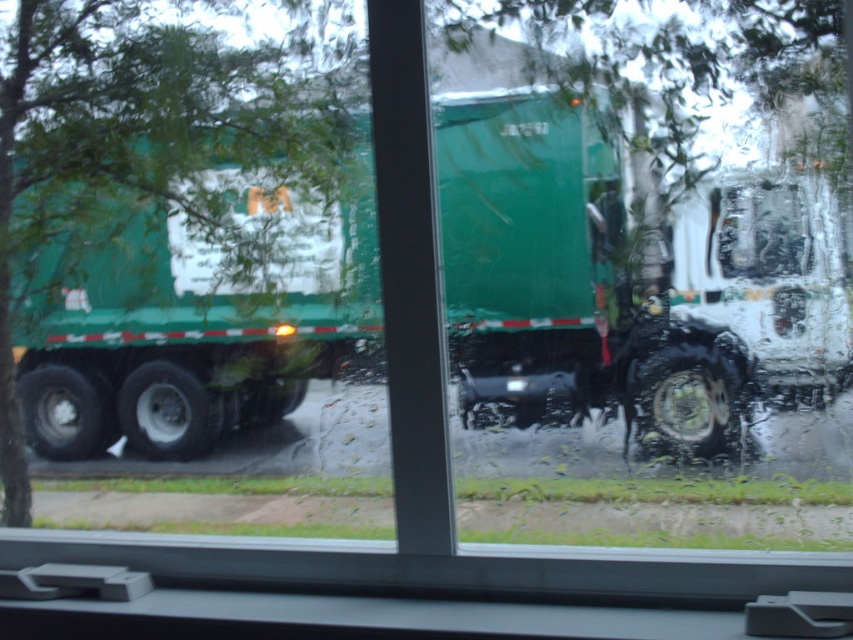
Question: Which point is farther from the camera taking this photo?

Choices:
 (A) (798, 227)
 (B) (74, 244)

Answer: (B)

Question: Which object is farther from the camera taking this photo?

Choices:
 (A) shiny metallic truck at center
 (B) green leafy tree at left

Answer: (B)

Question: Is green leafy tree at left closer to the viewer compared to shiny metallic truck at center?

Choices:
 (A) no
 (B) yes

Answer: (A)

Question: In this image, where is green leafy tree at left located relative to shiny metallic truck at center?

Choices:
 (A) left
 (B) right

Answer: (A)

Question: Is green leafy tree at left smaller than shiny metallic truck at center?

Choices:
 (A) no
 (B) yes

Answer: (A)

Question: Which point appears closest to the camera in this image?

Choices:
 (A) (310, 54)
 (B) (816, 368)

Answer: (B)